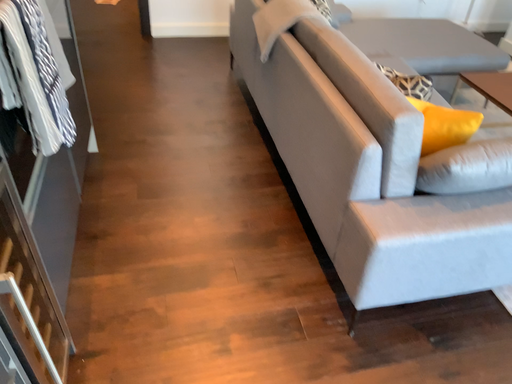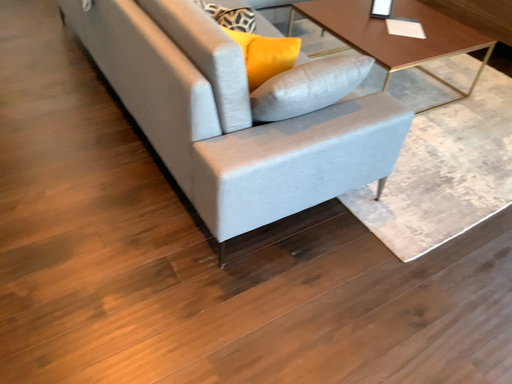
Question: How did the camera likely rotate when shooting the video?

Choices:
 (A) rotated right
 (B) rotated left

Answer: (A)